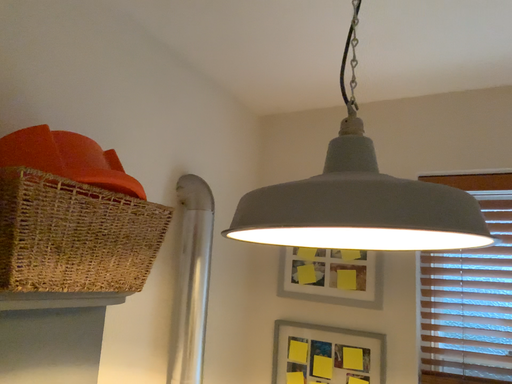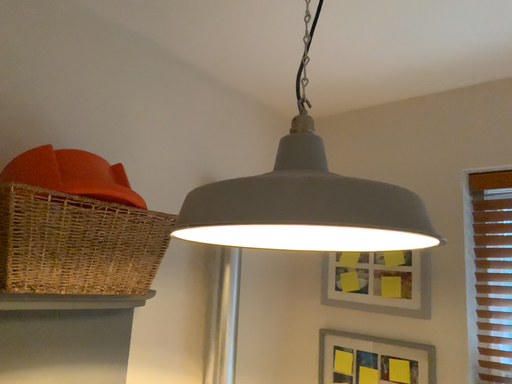
Question: How did the camera likely rotate when shooting the video?

Choices:
 (A) rotated right
 (B) rotated left

Answer: (B)